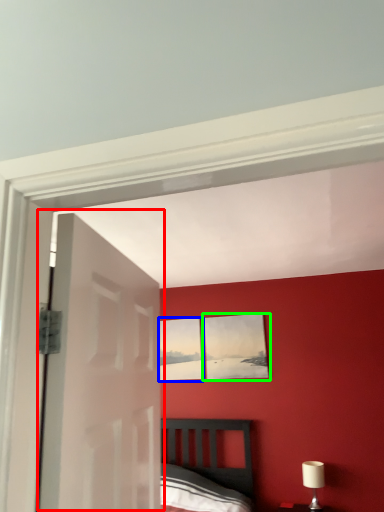
Question: Considering the real-world distances, which object is farthest from door (highlighted by a red box)? picture frame (highlighted by a blue box) or picture frame (highlighted by a green box)?

Choices:
 (A) picture frame
 (B) picture frame

Answer: (A)